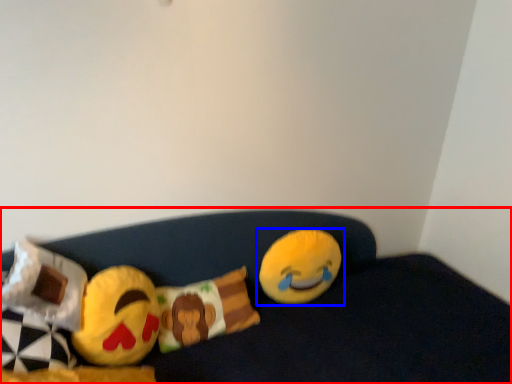
Question: Which object is closer to the camera taking this photo, furniture (highlighted by a red box) or toy (highlighted by a blue box)?

Choices:
 (A) furniture
 (B) toy

Answer: (A)